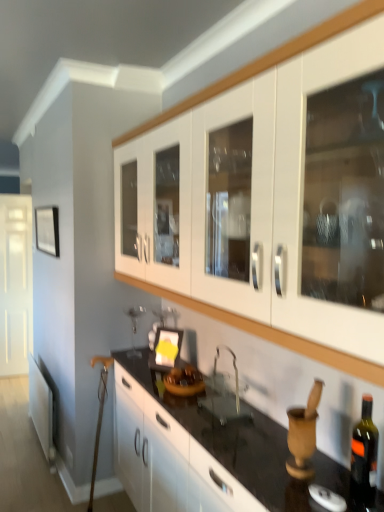
Question: From the image's perspective, is matte black picture frame at left, which ranks as the second picture frame in front-to-back order, over clear glass sink at center?

Choices:
 (A) no
 (B) yes

Answer: (B)

Question: Considering the relative sizes of matte black picture frame at left, which ranks as the 1th picture frame in back-to-front order, and clear glass sink at center in the image provided, is matte black picture frame at left, which ranks as the 1th picture frame in back-to-front order, bigger than clear glass sink at center?

Choices:
 (A) yes
 (B) no

Answer: (B)

Question: Considering the relative sizes of matte black picture frame at left, which ranks as the 1th picture frame in back-to-front order, and clear glass sink at center in the image provided, is matte black picture frame at left, which ranks as the 1th picture frame in back-to-front order, smaller than clear glass sink at center?

Choices:
 (A) yes
 (B) no

Answer: (A)

Question: Considering the relative sizes of matte black picture frame at left, which is the 1th picture frame in left-to-right order, and clear glass sink at center in the image provided, is matte black picture frame at left, which is the 1th picture frame in left-to-right order, wider than clear glass sink at center?

Choices:
 (A) yes
 (B) no

Answer: (B)

Question: Considering the relative sizes of matte black picture frame at left, acting as the first picture frame starting from the top, and clear glass sink at center in the image provided, is matte black picture frame at left, acting as the first picture frame starting from the top, shorter than clear glass sink at center?

Choices:
 (A) yes
 (B) no

Answer: (B)

Question: Based on their sizes in the image, would you say matte black picture frame at center, which is the 2th picture frame in top-to-bottom order, is bigger or smaller than clear glass sink at center?

Choices:
 (A) small
 (B) big

Answer: (A)

Question: Considering their positions, is matte black picture frame at center, the second picture frame in the back-to-front sequence, located in front of or behind clear glass sink at center?

Choices:
 (A) front
 (B) behind

Answer: (B)

Question: Considering the positions of point (175, 336) and point (210, 403), is point (175, 336) closer or farther from the camera than point (210, 403)?

Choices:
 (A) closer
 (B) farther

Answer: (B)

Question: In terms of width, does matte black picture frame at center, the 1th picture frame positioned from the front, look wider or thinner when compared to clear glass sink at center?

Choices:
 (A) thin
 (B) wide

Answer: (A)

Question: In terms of size, does clear glass sink at center appear bigger or smaller than black glossy countertop at center, which ranks as the 1th cabinetry in bottom-to-top order?

Choices:
 (A) big
 (B) small

Answer: (B)

Question: From a real-world perspective, relative to black glossy countertop at center, which is the second cabinetry from top to bottom, is clear glass sink at center vertically above or below?

Choices:
 (A) below
 (B) above

Answer: (B)

Question: From their relative heights in the image, would you say clear glass sink at center is taller or shorter than black glossy countertop at center, which ranks as the 1th cabinetry in bottom-to-top order?

Choices:
 (A) tall
 (B) short

Answer: (B)

Question: In the image, is clear glass sink at center on the left side or the right side of black glossy countertop at center, which is the second cabinetry from top to bottom?

Choices:
 (A) right
 (B) left

Answer: (A)

Question: From a real-world perspective, is white glossy door at left positioned above or below dark green glass bottle at lower right?

Choices:
 (A) above
 (B) below

Answer: (B)

Question: Would you say white glossy door at left is inside or outside dark green glass bottle at lower right?

Choices:
 (A) inside
 (B) outside

Answer: (B)